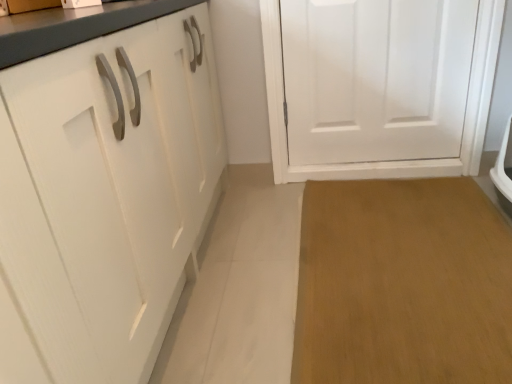
The image size is (512, 384). Find the location of `white matte door at center`. white matte door at center is located at coordinates (375, 78).

What do you see at coordinates (375, 78) in the screenshot? The width and height of the screenshot is (512, 384). I see `white matte door at center` at bounding box center [375, 78].

Describe the element at coordinates (403, 284) in the screenshot. I see `brown wood floor at lower right` at that location.

The image size is (512, 384). What are the coordinates of `brown wood floor at lower right` in the screenshot? It's located at (403, 284).

At what (x,y) coordinates should I click in order to perform the action: click on white matte door at center. Please return your answer as a coordinate pair (x, y). Looking at the image, I should click on (375, 78).

From the picture: Is brown wood floor at lower right at the left side of white matte door at center?

In fact, brown wood floor at lower right is to the right of white matte door at center.

Is brown wood floor at lower right in front of or behind white matte door at center in the image?

Clearly, brown wood floor at lower right is in front of white matte door at center.

Is point (344, 364) farther from camera compared to point (347, 48)?

No, it is in front of (347, 48).

From the image's perspective, between brown wood floor at lower right and white matte door at center, which one is located above?

white matte door at center, from the image's perspective.

From a real-world perspective, is brown wood floor at lower right located beneath white matte door at center?

Indeed, from a real-world perspective, brown wood floor at lower right is positioned beneath white matte door at center.

Which object is wider, brown wood floor at lower right or white matte door at center?

With larger width is brown wood floor at lower right.

Does brown wood floor at lower right have a lesser height compared to white matte door at center?

Yes.

Considering the sizes of brown wood floor at lower right and white matte door at center in the image, is brown wood floor at lower right bigger or smaller than white matte door at center?

In the image, brown wood floor at lower right appears to be smaller than white matte door at center.

Based on the photo, is brown wood floor at lower right surrounding white matte door at center?

No, white matte door at center is not a part of brown wood floor at lower right.

Is brown wood floor at lower right positioned far away from white matte door at center?

They are positioned close to each other.

Does brown wood floor at lower right turn towards white matte door at center?

No, brown wood floor at lower right is not oriented towards white matte door at center.

How many degrees apart are the facing directions of brown wood floor at lower right and white matte door at center?

The angle between the facing direction of brown wood floor at lower right and the facing direction of white matte door at center is 2.52 degrees.

Measure the distance from brown wood floor at lower right to white matte door at center.

brown wood floor at lower right and white matte door at center are 71.64 centimeters apart from each other.

Identify the location of door located above the brown wood floor at lower right (from the image's perspective). The height and width of the screenshot is (384, 512). (375, 78).

Based on their positions, is white matte door at center located to the left or right of brown wood floor at lower right?

Based on their positions, white matte door at center is located to the left of brown wood floor at lower right.

Is the position of white matte door at center less distant than that of brown wood floor at lower right?

No, it is behind brown wood floor at lower right.

Which is behind, point (384, 86) or point (442, 367)?

Positioned behind is point (384, 86).

From the image's perspective, which is below, white matte door at center or brown wood floor at lower right?

brown wood floor at lower right appears lower in the image.

From a real-world perspective, is white matte door at center under brown wood floor at lower right?

No, from a real-world perspective, white matte door at center is not beneath brown wood floor at lower right.

Considering the sizes of objects white matte door at center and brown wood floor at lower right in the image provided, who is thinner, white matte door at center or brown wood floor at lower right?

white matte door at center is thinner.

Can you confirm if white matte door at center is taller than brown wood floor at lower right?

Indeed, white matte door at center has a greater height compared to brown wood floor at lower right.

Considering the relative sizes of white matte door at center and brown wood floor at lower right in the image provided, is white matte door at center smaller than brown wood floor at lower right?

No, white matte door at center is not smaller than brown wood floor at lower right.

Is brown wood floor at lower right located within white matte door at center?

No, white matte door at center does not contain brown wood floor at lower right.

Is white matte door at center positioned far away from brown wood floor at lower right?

No.

Could you tell me if white matte door at center is turned towards brown wood floor at lower right?

Yes, white matte door at center is oriented towards brown wood floor at lower right.

How many degrees apart are the facing directions of white matte door at center and brown wood floor at lower right?

The angular difference between white matte door at center and brown wood floor at lower right is 2.52 degrees.

Measure the distance between white matte door at center and brown wood floor at lower right.

The distance of white matte door at center from brown wood floor at lower right is 28.20 inches.

Where is `plain in front of the white matte door at center`? This screenshot has width=512, height=384. plain in front of the white matte door at center is located at coordinates (403, 284).

In order to click on plain below the white matte door at center (from a real-world perspective) in this screenshot , I will do `click(403, 284)`.

Where is `door to the left of brown wood floor at lower right`? Image resolution: width=512 pixels, height=384 pixels. door to the left of brown wood floor at lower right is located at coordinates (375, 78).